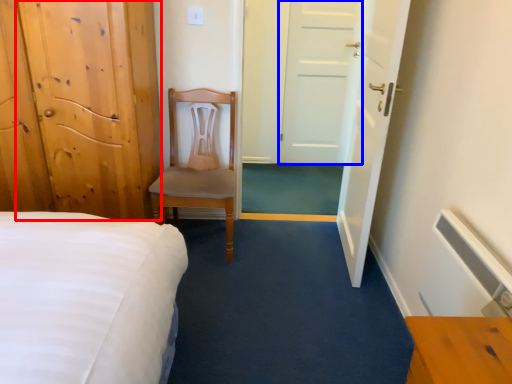
Question: Which object is further to the camera taking this photo, door (highlighted by a red box) or door (highlighted by a blue box)?

Choices:
 (A) door
 (B) door

Answer: (B)